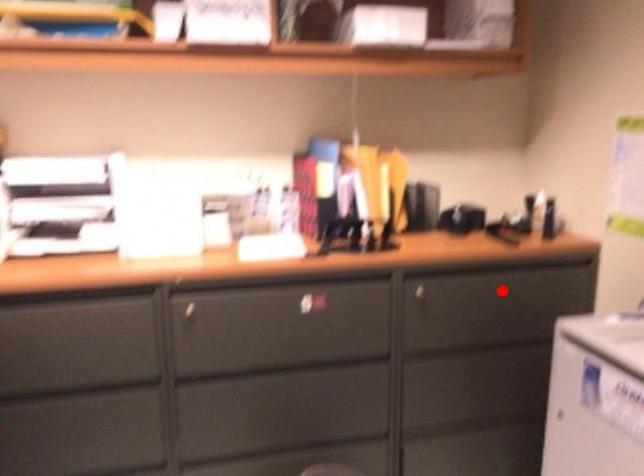
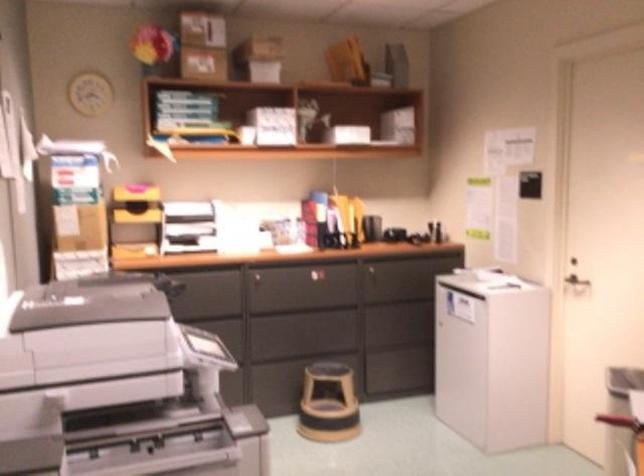
Where in the second image is the point corresponding to the highlighted location from the first image?

(417, 267)